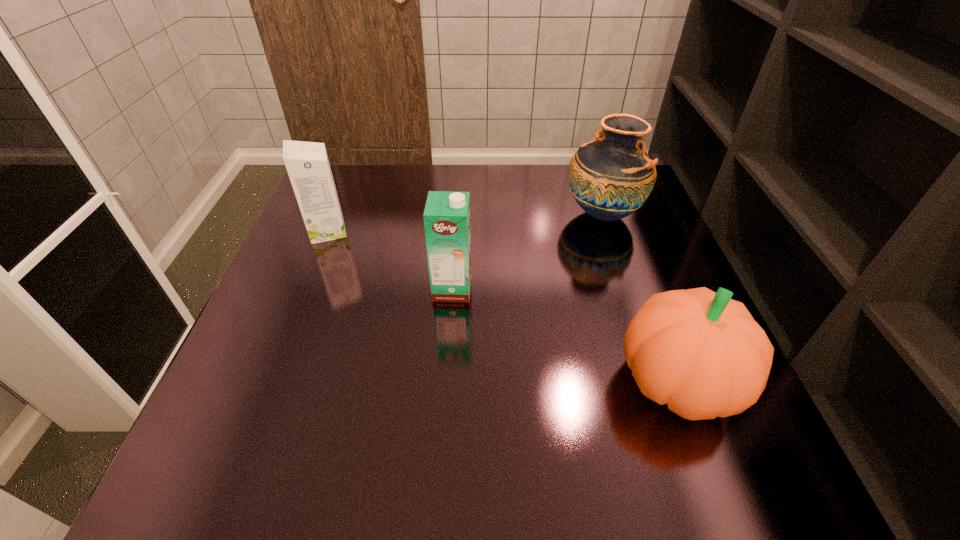
I want to click on pottery, so click(610, 177).

Locate an element on the screen. The image size is (960, 540). the third object from right to left is located at coordinates (446, 216).

Locate an element on the screen. Image resolution: width=960 pixels, height=540 pixels. the nearer carton is located at coordinates (446, 216).

You are a GUI agent. You are given a task and a screenshot of the screen. Output one action in this format:
    pyautogui.click(x=<x>, y=<y>)
    Task: Click on the left carton
    
    Given the screenshot: What is the action you would take?
    pyautogui.click(x=307, y=164)

Identify the location of the farther carton. (307, 164).

I want to click on the nearest object, so 700,352.

I want to click on free location located 0.340m on the front of the pottery, so click(x=649, y=352).

Locate an element on the screen. The height and width of the screenshot is (540, 960). vacant space located 0.210m on the front of the second nearest object is located at coordinates (446, 389).

The image size is (960, 540). I want to click on vacant space positioned 0.110m on the back of the leftmost object, so click(343, 195).

Identify the location of vacant space positioned on the back of the nearest object. (620, 226).